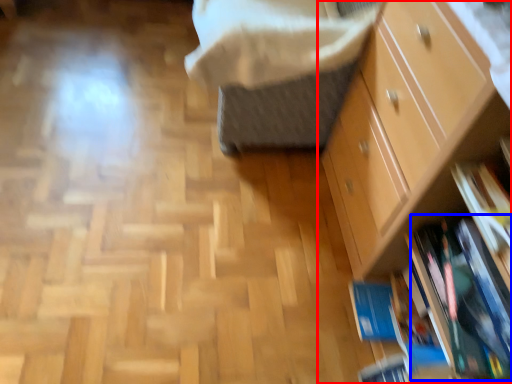
Question: Which object is further to the camera taking this photo, chest of drawers (highlighted by a red box) or book (highlighted by a blue box)?

Choices:
 (A) chest of drawers
 (B) book

Answer: (B)